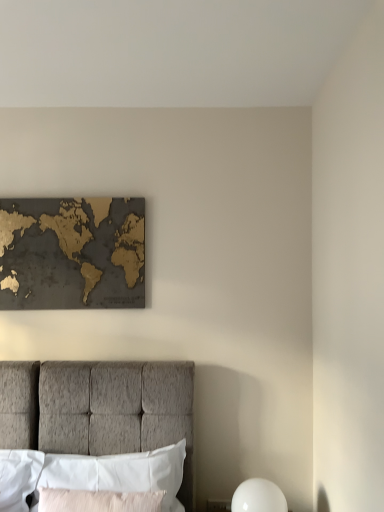
Question: From a real-world perspective, does light pink fabric pillow at lower center, positioned as the 2th pillow in back-to-front order, stand above white fabric pillow at lower left, the 2th pillow in the front-to-back sequence?

Choices:
 (A) yes
 (B) no

Answer: (B)

Question: Considering the relative positions of light pink fabric pillow at lower center, the first pillow positioned from the front, and white fabric pillow at lower left, positioned as the first pillow in back-to-front order, in the image provided, is light pink fabric pillow at lower center, the first pillow positioned from the front, to the left of white fabric pillow at lower left, positioned as the first pillow in back-to-front order, from the viewer's perspective?

Choices:
 (A) no
 (B) yes

Answer: (B)

Question: Could you tell me if light pink fabric pillow at lower center, positioned as the 2th pillow in back-to-front order, is turned towards white fabric pillow at lower left, the 2th pillow in the front-to-back sequence?

Choices:
 (A) no
 (B) yes

Answer: (A)

Question: Is light pink fabric pillow at lower center, the first pillow positioned from the front, looking in the opposite direction of white fabric pillow at lower left, the 2th pillow in the front-to-back sequence?

Choices:
 (A) no
 (B) yes

Answer: (B)

Question: Is light pink fabric pillow at lower center, the first pillow positioned from the front, situated inside gold metallic map at upper center or outside?

Choices:
 (A) outside
 (B) inside

Answer: (A)

Question: Considering the positions of light pink fabric pillow at lower center, positioned as the 2th pillow in back-to-front order, and gold metallic map at upper center in the image, is light pink fabric pillow at lower center, positioned as the 2th pillow in back-to-front order, taller or shorter than gold metallic map at upper center?

Choices:
 (A) short
 (B) tall

Answer: (A)

Question: From a real-world perspective, is light pink fabric pillow at lower center, the first pillow positioned from the front, above or below gold metallic map at upper center?

Choices:
 (A) below
 (B) above

Answer: (A)

Question: Does point (46, 495) appear closer or farther from the camera than point (49, 303)?

Choices:
 (A) farther
 (B) closer

Answer: (B)

Question: In terms of width, does gold metallic map at upper center look wider or thinner when compared to white fabric pillow at lower left, the 2th pillow in the front-to-back sequence?

Choices:
 (A) wide
 (B) thin

Answer: (B)

Question: Does point [140, 264] appear closer or farther from the camera than point [139, 490]?

Choices:
 (A) farther
 (B) closer

Answer: (A)

Question: From the image's perspective, is gold metallic map at upper center located above or below white fabric pillow at lower left, positioned as the first pillow in back-to-front order?

Choices:
 (A) above
 (B) below

Answer: (A)

Question: In the image, is gold metallic map at upper center on the left side or the right side of white fabric pillow at lower left, positioned as the first pillow in back-to-front order?

Choices:
 (A) left
 (B) right

Answer: (A)

Question: Would you say light pink fabric pillow at lower center, positioned as the 2th pillow in back-to-front order, is inside or outside white fabric pillow at lower left, positioned as the first pillow in back-to-front order?

Choices:
 (A) inside
 (B) outside

Answer: (B)

Question: Is light pink fabric pillow at lower center, the first pillow positioned from the front, in front of or behind white fabric pillow at lower left, the 2th pillow in the front-to-back sequence, in the image?

Choices:
 (A) front
 (B) behind

Answer: (A)